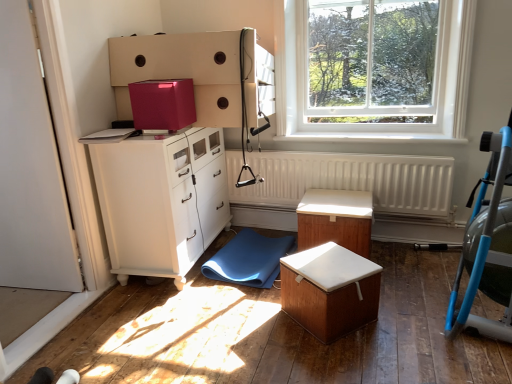
Question: Is blue plastic baby carriage at right spatially inside blue rubber mat at lower center, or outside of it?

Choices:
 (A) outside
 (B) inside

Answer: (A)

Question: In terms of width, does blue plastic baby carriage at right look wider or thinner when compared to blue rubber mat at lower center?

Choices:
 (A) wide
 (B) thin

Answer: (B)

Question: Considering the real-world distances, which object is farthest from the white glossy cabinet at left?

Choices:
 (A) wooden box with white cushion at center, marked as the first table in a front-to-back arrangement
 (B) white matte radiator at center
 (C) wooden table at center, the 2th table viewed from the front
 (D) blue plastic baby carriage at right
 (E) blue rubber mat at lower center

Answer: (D)

Question: Estimate the real-world distances between objects in this image. Which object is farther from the wooden table at center, the 2th table viewed from the front?

Choices:
 (A) white matte radiator at center
 (B) clear glass window at upper right
 (C) white glossy cabinet at left
 (D) blue rubber mat at lower center
 (E) blue plastic baby carriage at right

Answer: (C)